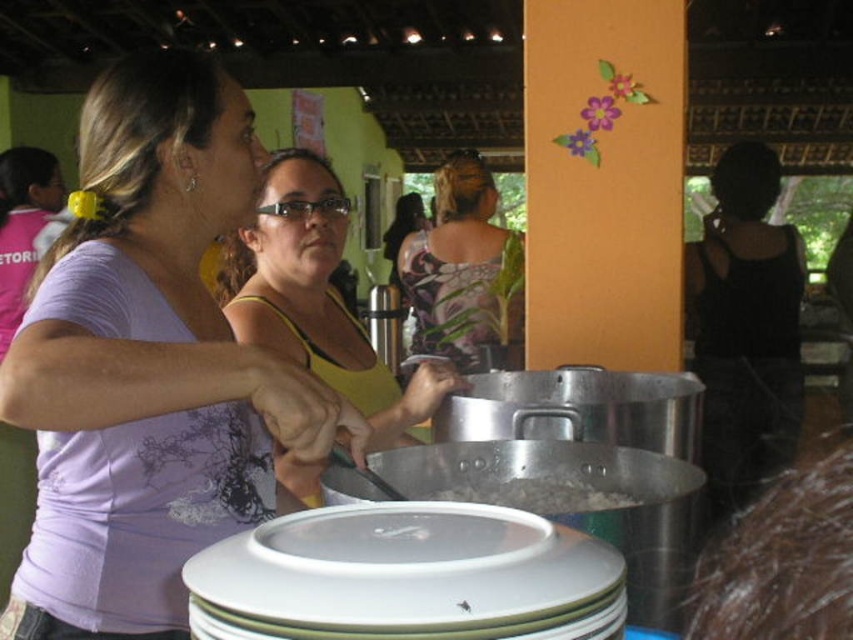
Which is in front, point (440, 205) or point (590, 508)?

Point (590, 508) is in front.

Does point (450, 307) come in front of point (503, 486)?

No, it is behind (503, 486).

Where is `floral-patterned fabric at center`? The width and height of the screenshot is (853, 640). floral-patterned fabric at center is located at coordinates (456, 264).

Based on the photo, is purple fabric shirt at upper left thinner than black matte tank top at right?

Yes, purple fabric shirt at upper left is thinner than black matte tank top at right.

Who is more forward, (222,84) or (723,230)?

Point (222,84) is in front.

Where is `purple fabric shirt at upper left`? The width and height of the screenshot is (853, 640). purple fabric shirt at upper left is located at coordinates (148, 364).

I want to click on purple fabric shirt at upper left, so click(148, 364).

Looking at this image, is black matte tank top at right thinner than floral-patterned fabric at center?

No, black matte tank top at right is not thinner than floral-patterned fabric at center.

Can you confirm if black matte tank top at right is shorter than floral-patterned fabric at center?

No, black matte tank top at right is not shorter than floral-patterned fabric at center.

Who is more forward, [730,506] or [459,280]?

Point [730,506] is in front.

Locate an element on the screen. The height and width of the screenshot is (640, 853). black matte tank top at right is located at coordinates (746, 324).